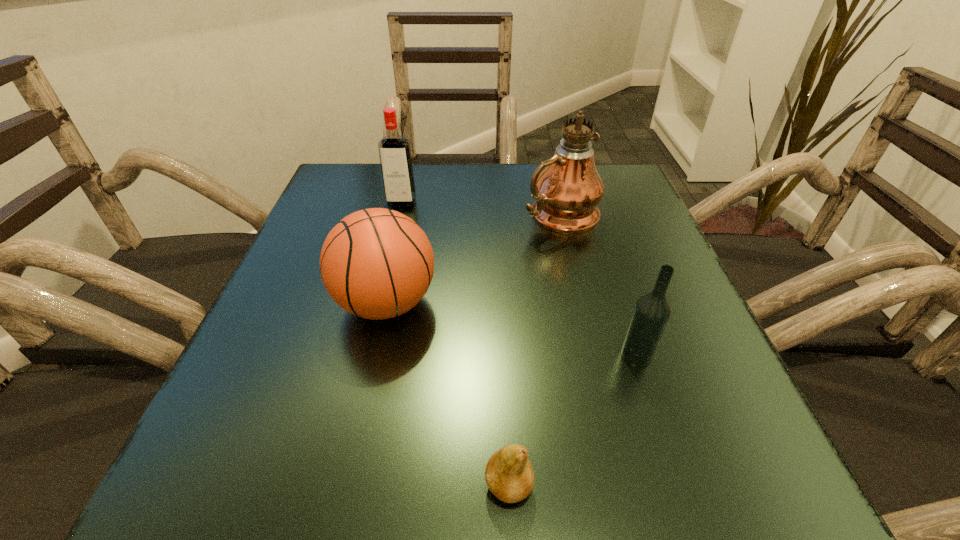
Where is `oil lamp`? The image size is (960, 540). oil lamp is located at coordinates 567,192.

Locate an element on the screen. This screenshot has width=960, height=540. the left vodka is located at coordinates (394, 150).

Image resolution: width=960 pixels, height=540 pixels. I want to click on the farther vodka, so click(x=394, y=150).

This screenshot has height=540, width=960. What are the coordinates of `basketball` in the screenshot? It's located at (376, 263).

I want to click on the nearer vodka, so tap(652, 311).

Where is `the shorter vodka`? This screenshot has height=540, width=960. the shorter vodka is located at coordinates (652, 311).

This screenshot has height=540, width=960. Find the location of `the nearest object`. the nearest object is located at coordinates (509, 475).

The height and width of the screenshot is (540, 960). I want to click on the shortest object, so [509, 475].

This screenshot has width=960, height=540. Identify the location of vacant region located on the front of the oil lamp. (578, 289).

You are a GUI agent. You are given a task and a screenshot of the screen. Output one action in this format:
    pyautogui.click(x=<x>, y=<y>)
    Task: Click on the free space located on the front and back of the farther vodka
    
    Given the screenshot: What is the action you would take?
    pyautogui.click(x=393, y=238)